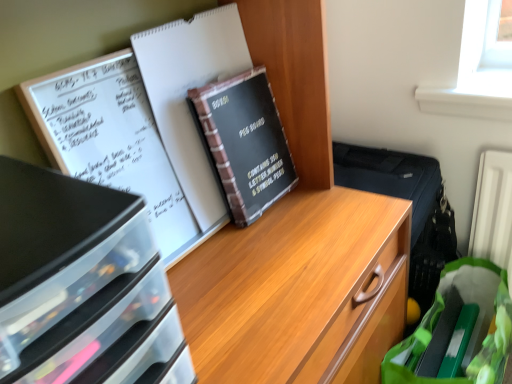
Question: In the image, is black matte peg board at center positioned in front of or behind black paper journal at center?

Choices:
 (A) behind
 (B) front

Answer: (A)

Question: From the image's perspective, is black matte peg board at center located above or below black paper journal at center?

Choices:
 (A) below
 (B) above

Answer: (A)

Question: Based on their relative distances, which object is nearer to the green fabric grocery bag at lower right?

Choices:
 (A) black matte peg board at center
 (B) black plastic drawers at left
 (C) black paper journal at center

Answer: (A)

Question: Considering the real-world distances, which object is closest to the black plastic drawers at left?

Choices:
 (A) black matte peg board at center
 (B) green fabric grocery bag at lower right
 (C) black paper journal at center

Answer: (C)